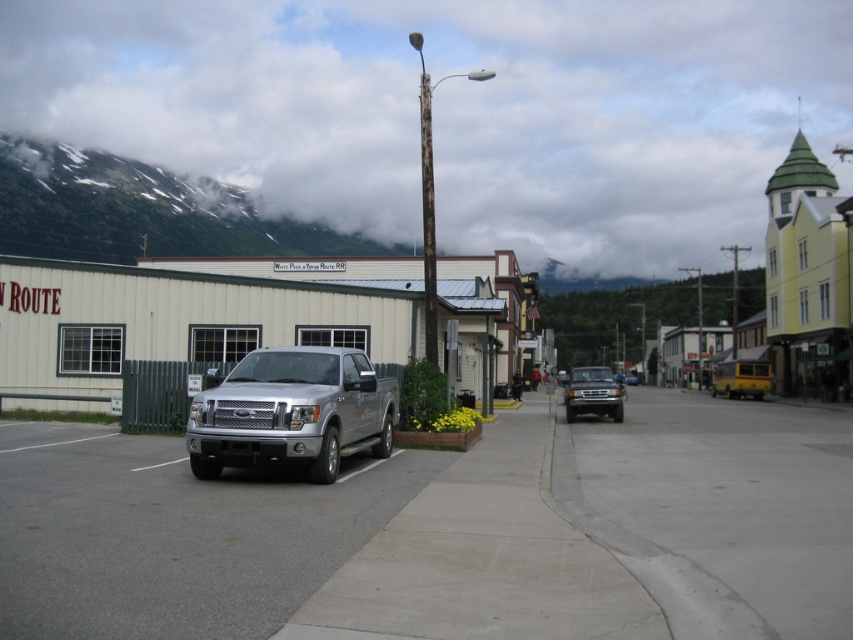
Question: Based on their relative distances, which object is nearer to the metallic silver truck at center?

Choices:
 (A) yellow matte bus at center
 (B) green rocky mountain at upper left

Answer: (A)

Question: Can you confirm if gray asphalt pavement at center is positioned to the left of silver metallic truck at center?

Choices:
 (A) yes
 (B) no

Answer: (A)

Question: Estimate the real-world distances between objects in this image. Which object is farther from the green rocky mountain at upper left?

Choices:
 (A) silver metallic truck at center
 (B) yellow matte bus at center

Answer: (A)

Question: Does gray asphalt pavement at center have a greater width compared to yellow matte bus at center?

Choices:
 (A) yes
 (B) no

Answer: (B)

Question: Does gray asphalt pavement at center have a lesser width compared to gray concrete pavement at center?

Choices:
 (A) yes
 (B) no

Answer: (A)

Question: Among these points, which one is nearest to the camera?

Choices:
 (A) (753, 371)
 (B) (364, 378)
 (C) (727, 529)

Answer: (C)